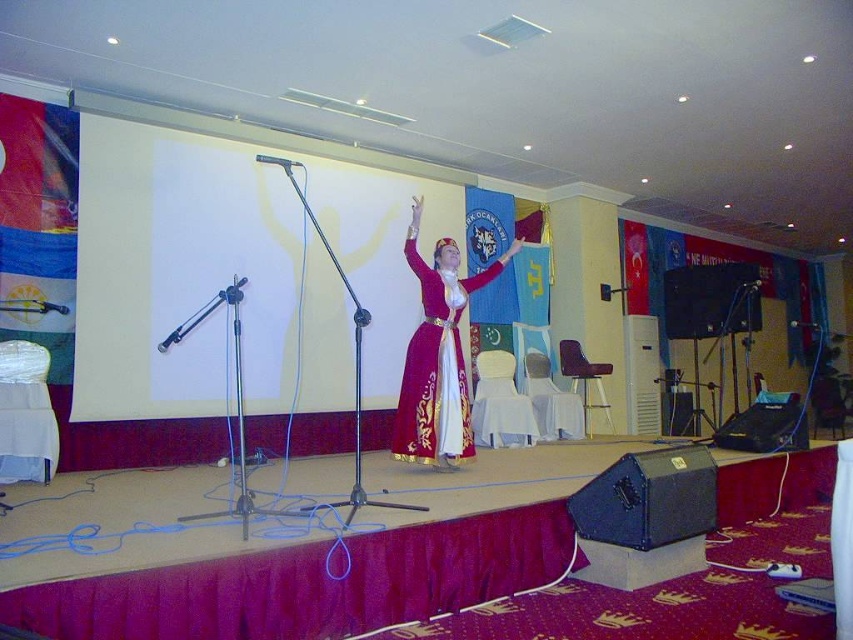
You are a photographer positioned at the back of the hall. You need to capture a photo where both the velvet maroon dress at center and the black metallic microphone at center are clearly visible. Based on their positions, which object should you focus on first to ensure both are in frame?

The velvet maroon dress at center is below the black metallic microphone at center. To ensure both are in frame, focus on the black metallic microphone at center first as it is higher up, allowing the dress to be captured below it.

You are an event coordinator arranging items on stage. You need to place a metallic silver microphone at left and a velvet maroon dress at center. According to the current setup, which object is positioned to the right of the other?

The velvet maroon dress at center is positioned to the right of the metallic silver microphone at left.

You are a photographer positioned at the back of the hall. You need to capture a clear photo of both the velvet maroon dress at center and the metallic silver microphone at left. Can you ensure both are in focus without adjusting your camera settings?

The velvet maroon dress at center is taller than the metallic silver microphone at left, so if they are at different distances from the camera, adjusting focus might be needed. However, if they are within the same focal plane, both can be in focus without changes.